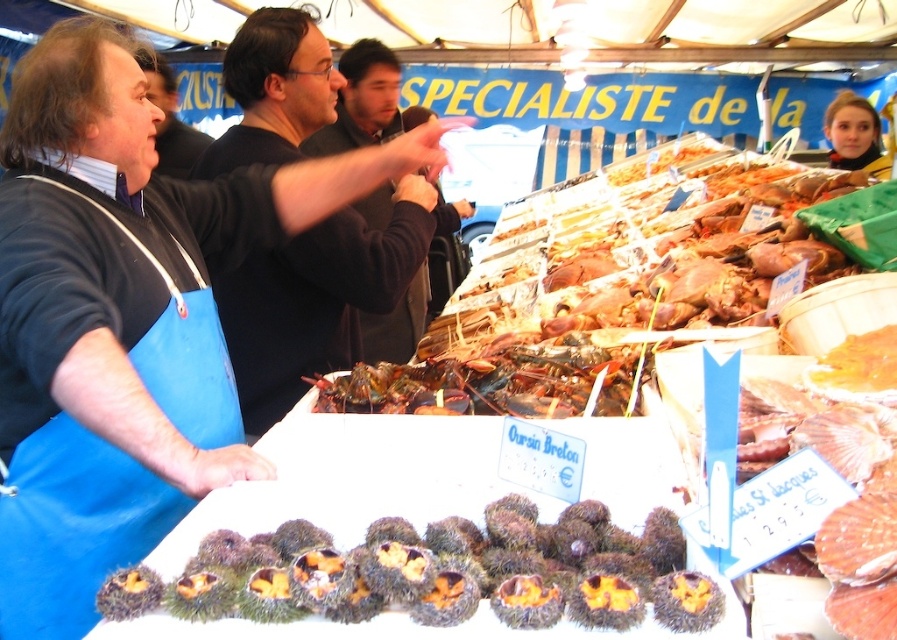
Question: Which is nearer to the brown fuzzy sea urchins at center?

Choices:
 (A) black sweater at center
 (B) dark brown sweater at center

Answer: (A)

Question: Which point appears farthest from the camera in this image?

Choices:
 (A) (161, 97)
 (B) (355, 81)
 (C) (263, 358)
 (D) (257, 595)

Answer: (A)

Question: Among these objects, which one is nearest to the camera?

Choices:
 (A) dark brown sweater at center
 (B) brown fuzzy sea urchins at center

Answer: (B)

Question: Does dark brown sweater at center appear over matte black apron at upper left?

Choices:
 (A) no
 (B) yes

Answer: (A)

Question: Can you confirm if brown fuzzy sea urchins at center is positioned below black sweater at center?

Choices:
 (A) yes
 (B) no

Answer: (A)

Question: Is brown fuzzy sea urchins at center to the right of matte black apron at upper left from the viewer's perspective?

Choices:
 (A) yes
 (B) no

Answer: (A)